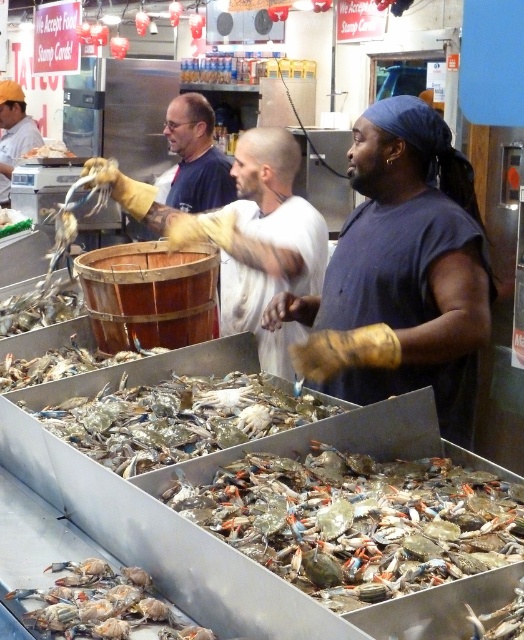
Is the position of dark blue t-shirt at center more distant than that of shiny metallic crab at center?

Yes, it is behind shiny metallic crab at center.

Can you confirm if dark blue t-shirt at center is smaller than shiny metallic crab at center?

Incorrect, dark blue t-shirt at center is not smaller in size than shiny metallic crab at center.

The image size is (524, 640). What are the coordinates of `dark blue t-shirt at center` in the screenshot? It's located at (408, 264).

At what (x,y) coordinates should I click in order to perform the action: click on dark blue t-shirt at center. Please return your answer as a coordinate pair (x, y). The width and height of the screenshot is (524, 640). Looking at the image, I should click on (408, 264).

Find the location of a particular element. shiny metallic crab at center is located at coordinates (358, 520).

Can you confirm if shiny metallic crab at center is positioned to the right of yellow rubber gloves at center?

Correct, you'll find shiny metallic crab at center to the right of yellow rubber gloves at center.

Is point (442, 550) positioned after point (298, 269)?

No, (442, 550) is in front of (298, 269).

Locate an element on the screen. This screenshot has height=640, width=524. shiny metallic crab at center is located at coordinates tap(358, 520).

Does shiny metallic crab at center appear on the right side of wooden barrel at center?

Yes, shiny metallic crab at center is to the right of wooden barrel at center.

Can you confirm if shiny metallic crab at center is positioned below wooden barrel at center?

Yes, shiny metallic crab at center is below wooden barrel at center.

Which is behind, point (286, 500) or point (117, 333)?

The point (117, 333) is more distant.

Find the location of a particular element. The image size is (524, 640). shiny metallic crab at center is located at coordinates (358, 520).